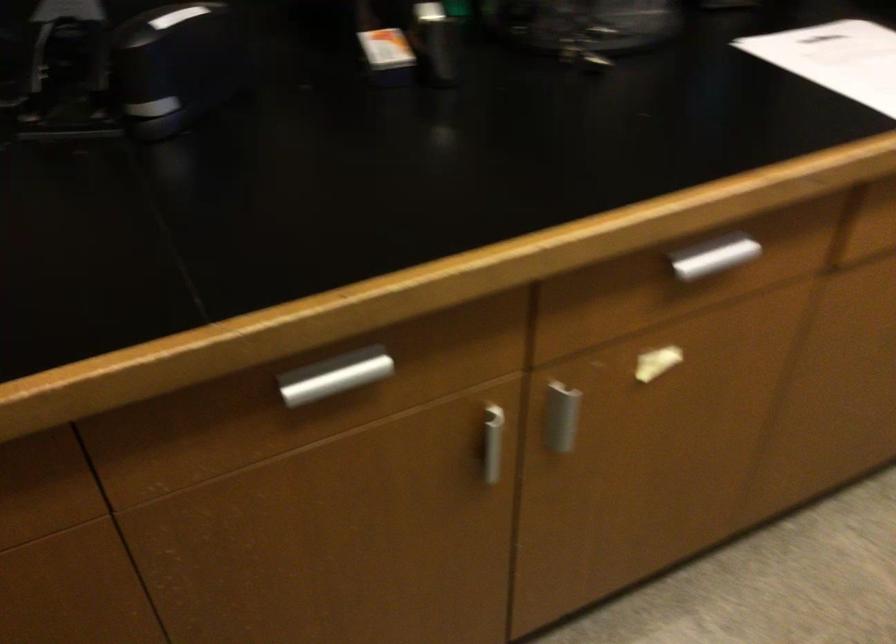
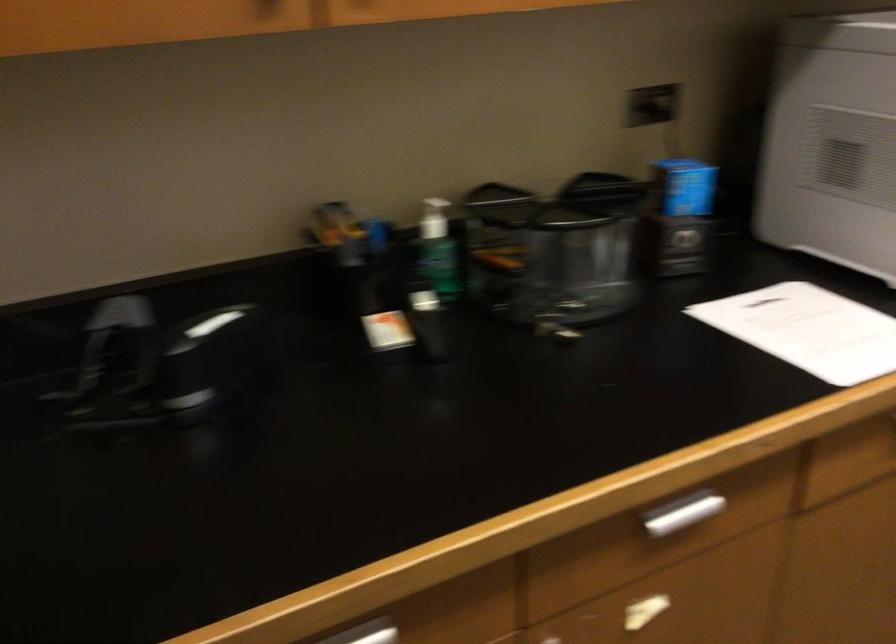
Locate, in the second image, the point that corresponds to the point at 718,259 in the first image.

(686, 514)